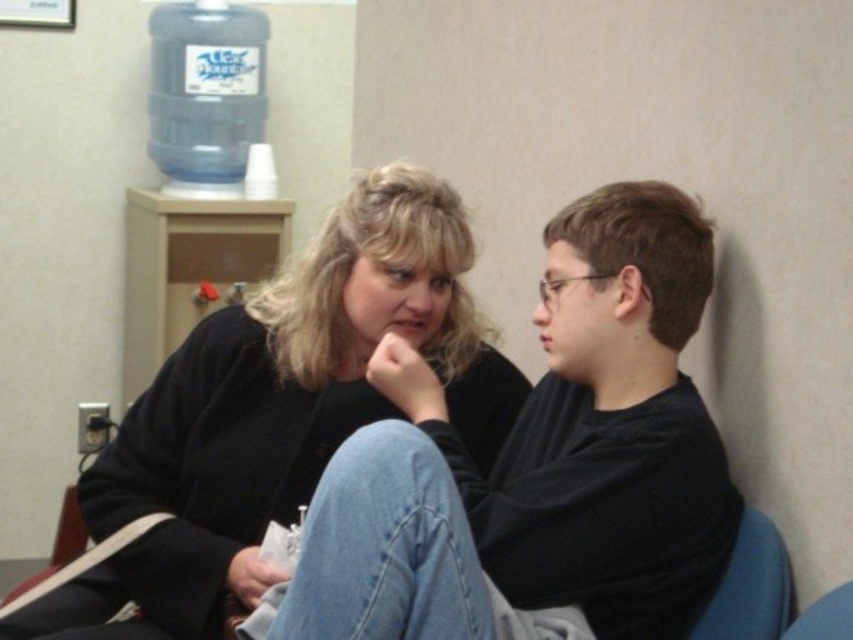
You are a delivery person who needs to place a package between the matte black sweater at center and the blue plastic water cooler at upper left. The package measures 2 feet in length. Can you fit it in the space between them?

The distance between the matte black sweater at center and the blue plastic water cooler at upper left is 5.25 feet, which is more than enough to fit a 2 feet long package.

You are standing in the room and need to place a small plant on the floor near the matte black sweater at center. Based on the coordinates provided, where should you place the plant relative to the sweater?

The matte black sweater at center is located at point 0.653 on the x and 0.318 on the y axis. To place the plant near it, position it close to these coordinates on the floor.